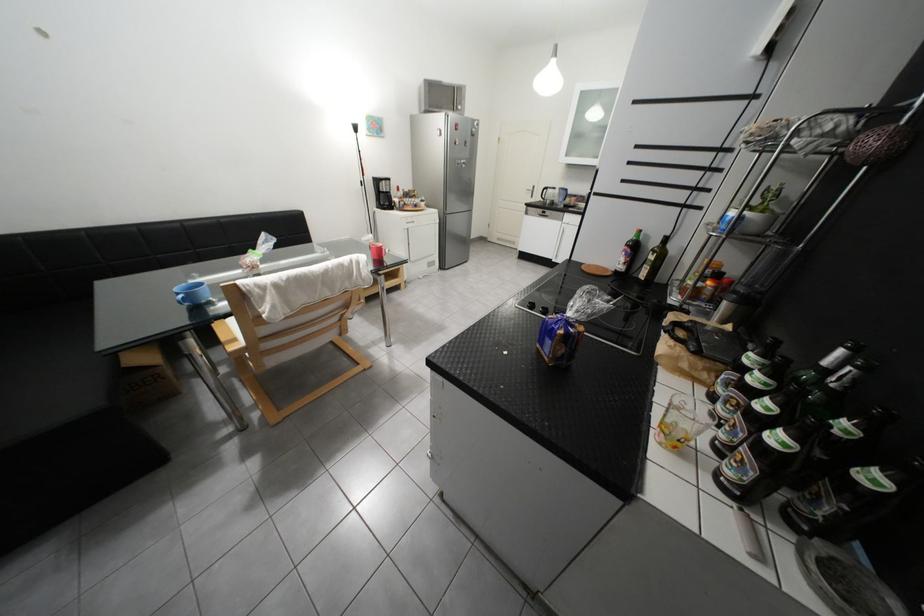
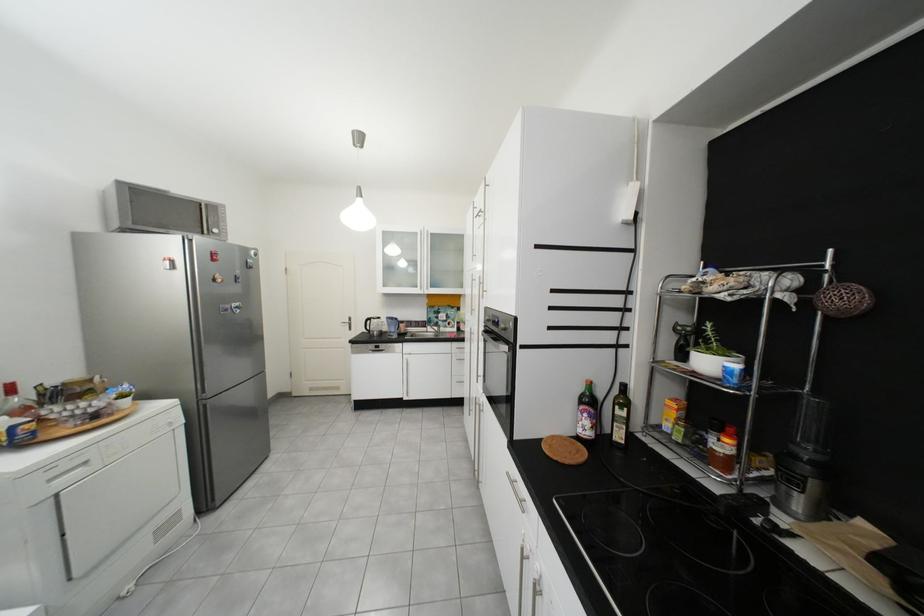
In the second image, find the point that corresponds to (x=453, y=136) in the first image.

(185, 269)